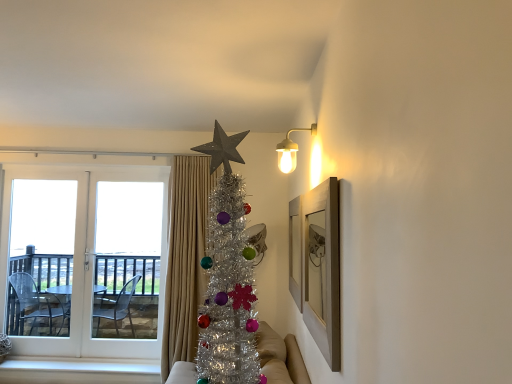
Image resolution: width=512 pixels, height=384 pixels. What are the coordinates of `vacant space situated above white glass door at left (from a real-world perspective)` in the screenshot? It's located at (81, 168).